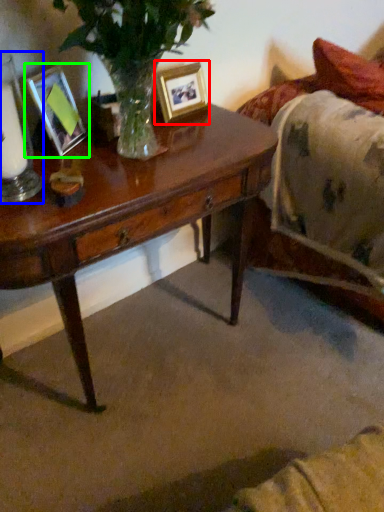
Question: Which is nearer to the picture frame (highlighted by a red box)? candle holder (highlighted by a blue box) or picture frame (highlighted by a green box).

Choices:
 (A) candle holder
 (B) picture frame

Answer: (B)